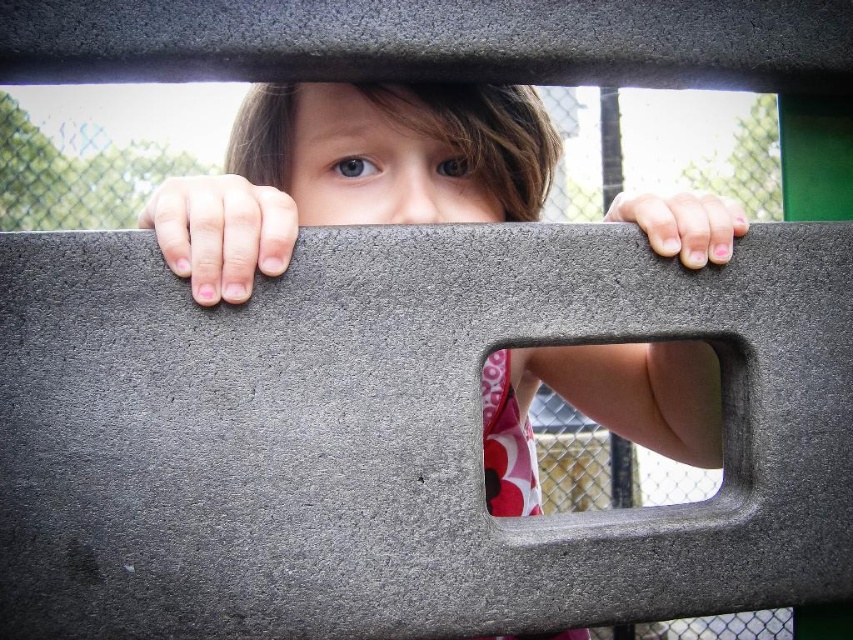
Question: Is matte gray concrete at center smaller than pink fabric at center?

Choices:
 (A) yes
 (B) no

Answer: (B)

Question: Where is matte gray concrete at center located in relation to pink fabric at center in the image?

Choices:
 (A) above
 (B) below

Answer: (A)

Question: In this image, where is matte gray concrete at center located relative to pink fabric at center?

Choices:
 (A) left
 (B) right

Answer: (A)

Question: Which point appears closest to the camera in this image?

Choices:
 (A) (643, 435)
 (B) (544, 353)

Answer: (A)